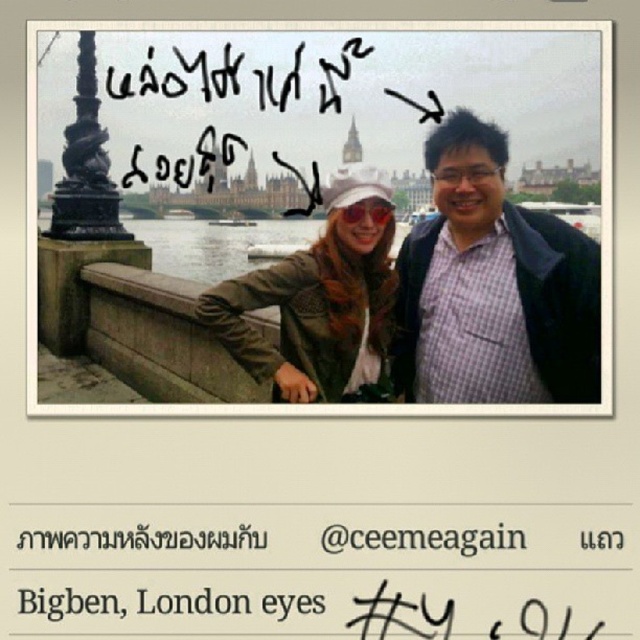
Based on the photo, you are a photographer trying to capture a wide shot of the matte plaid shirt at center and the concrete ledge at lower left. Given that your camera can only focus on objects within 25 meters of each other, will you be able to capture both in focus?

The matte plaid shirt at center and concrete ledge at lower left are 26.54 meters apart from each other, so the camera cannot focus on both since they are beyond the 25 meters limit.

You are a photographer trying to adjust the focus on your camera. You notice two points in the image at coordinates point [321,320] and point [168,284]. Which point should you focus on first to ensure the subject closest to the camera is sharp?

Point [321,320] should be focused on first because it is closer to the camera than point [168,284], ensuring the nearest subject is in sharp focus.